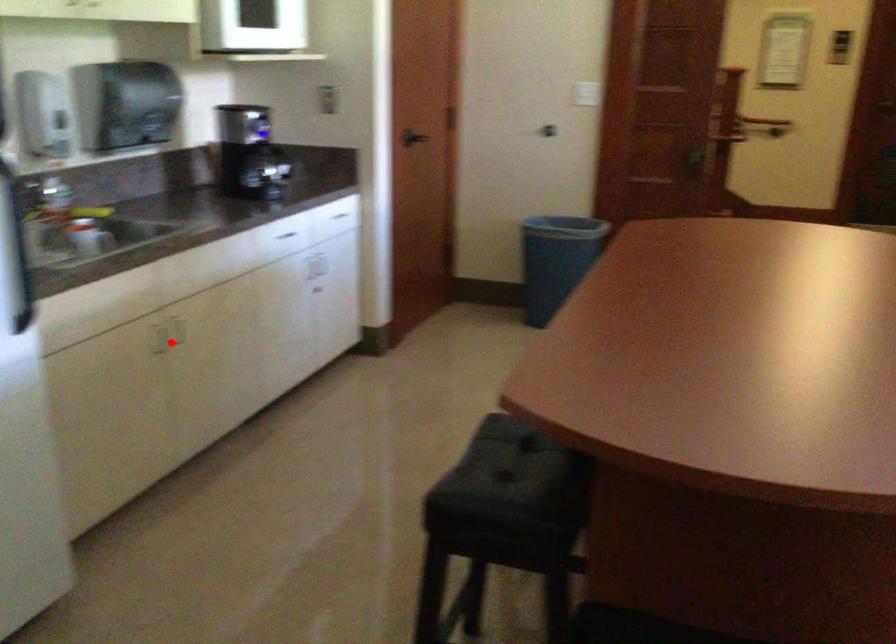
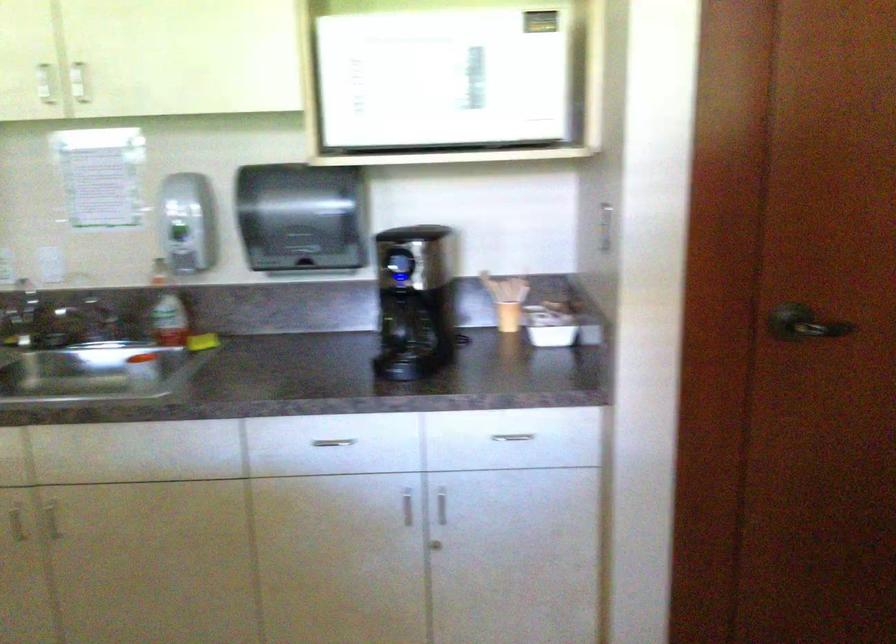
Find the pixel in the second image that matches the highlighted location in the first image.

(52, 520)